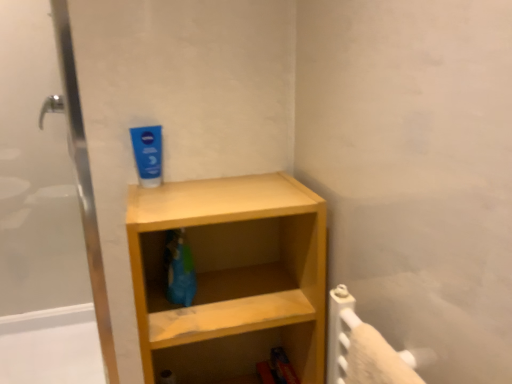
Question: In terms of height, does blue matte toothpaste at upper center look taller or shorter compared to light wood shelf at center?

Choices:
 (A) tall
 (B) short

Answer: (B)

Question: Considering the positions of blue matte toothpaste at upper center and light wood shelf at center in the image, is blue matte toothpaste at upper center bigger or smaller than light wood shelf at center?

Choices:
 (A) small
 (B) big

Answer: (A)

Question: Looking at their shapes, would you say blue matte toothpaste at upper center is wider or thinner than light wood shelf at center?

Choices:
 (A) wide
 (B) thin

Answer: (B)

Question: From a real-world perspective, relative to blue matte toothpaste at upper center, is light wood shelf at center vertically above or below?

Choices:
 (A) below
 (B) above

Answer: (A)

Question: Is light wood shelf at center situated inside blue matte toothpaste at upper center or outside?

Choices:
 (A) inside
 (B) outside

Answer: (B)

Question: Considering the positions of light wood shelf at center and blue matte toothpaste at upper center in the image, is light wood shelf at center taller or shorter than blue matte toothpaste at upper center?

Choices:
 (A) short
 (B) tall

Answer: (B)

Question: Considering the positions of light wood shelf at center and blue matte toothpaste at upper center in the image, is light wood shelf at center wider or thinner than blue matte toothpaste at upper center?

Choices:
 (A) thin
 (B) wide

Answer: (B)